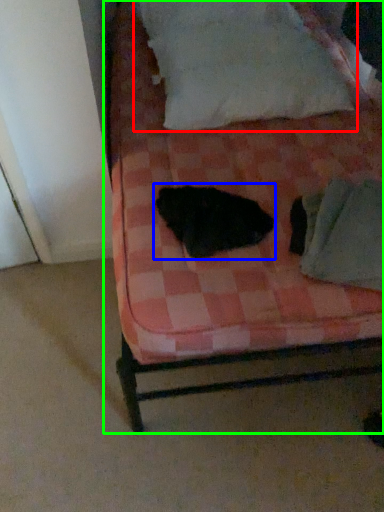
Question: Based on their relative distances, which object is farther from pillow (highlighted by a red box)? Choose from animal (highlighted by a blue box) and bed (highlighted by a green box).

Choices:
 (A) animal
 (B) bed

Answer: (A)